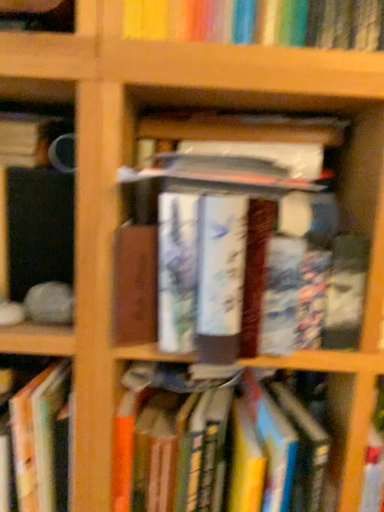
What do you see at coordinates (246, 68) in the screenshot? I see `wooden shelf at upper center` at bounding box center [246, 68].

The height and width of the screenshot is (512, 384). Find the location of `hardcover book at center, arranged as the 3th book when ordered from the bottom`. hardcover book at center, arranged as the 3th book when ordered from the bottom is located at coordinates (252, 264).

Describe the element at coordinates (252, 264) in the screenshot. The image size is (384, 512). I see `hardcover book at center, arranged as the 3th book when ordered from the bottom` at that location.

What do you see at coordinates (29, 138) in the screenshot? This screenshot has height=512, width=384. I see `matte black mug at left, arranged as the 1th book when viewed from the top` at bounding box center [29, 138].

You are a GUI agent. You are given a task and a screenshot of the screen. Output one action in this format:
    pyautogui.click(x=<x>, y=<y>)
    Task: Click on the matte black mug at left, which is the fourth book in bottom-to-top order
    The width and height of the screenshot is (384, 512).
    Given the screenshot: What is the action you would take?
    coord(29,138)

Where is `wooden shelf at upper center`? wooden shelf at upper center is located at coordinates (246, 68).

Considering the relative sizes of hardcover book at center, the 2th book from the top, and wooden shelf at upper center in the image provided, is hardcover book at center, the 2th book from the top, smaller than wooden shelf at upper center?

Actually, hardcover book at center, the 2th book from the top, might be larger than wooden shelf at upper center.

Is hardcover book at center, the 2th book from the top, inside the boundaries of wooden shelf at upper center, or outside?

hardcover book at center, the 2th book from the top, is outside wooden shelf at upper center.

Is hardcover book at center, the 2th book from the top, turned away from wooden shelf at upper center?

No, hardcover book at center, the 2th book from the top, is not facing away from wooden shelf at upper center.

Looking at their sizes, would you say hardcover book at center, arranged as the 3th book when ordered from the bottom, is wider or thinner than wooden shelf at upper center?

Considering their sizes, hardcover book at center, arranged as the 3th book when ordered from the bottom, looks slimmer than wooden shelf at upper center.

Does hardcover book at lower left, the third book when ordered from top to bottom, have a lesser width compared to hardcover book at center, the 2th book from the top?

Yes.

Considering the sizes of objects hardcover book at lower left, the third book when ordered from top to bottom, and hardcover book at center, arranged as the 3th book when ordered from the bottom, in the image provided, who is shorter, hardcover book at lower left, the third book when ordered from top to bottom, or hardcover book at center, arranged as the 3th book when ordered from the bottom,?

hardcover book at center, arranged as the 3th book when ordered from the bottom, is shorter.

Is hardcover book at lower left, the second book from the bottom, not close to hardcover book at center, arranged as the 3th book when ordered from the bottom?

No, hardcover book at lower left, the second book from the bottom, is not far away from hardcover book at center, arranged as the 3th book when ordered from the bottom.

Is hardcover book at lower left, the second book from the bottom, in front of or behind hardcover book at center, the 2th book from the top, in the image?

hardcover book at lower left, the second book from the bottom, is behind hardcover book at center, the 2th book from the top.

Measure the distance between wooden shelf at upper center and hardcover book at center, the 2th book from the top.

The distance of wooden shelf at upper center from hardcover book at center, the 2th book from the top, is 8.61 inches.

Is wooden shelf at upper center located outside hardcover book at center, the 2th book from the top?

Yes, wooden shelf at upper center is not within hardcover book at center, the 2th book from the top.

Is wooden shelf at upper center bigger than hardcover book at center, the 2th book from the top?

Actually, wooden shelf at upper center might be smaller than hardcover book at center, the 2th book from the top.

Considering the points (137, 56) and (290, 203), which point is behind, point (137, 56) or point (290, 203)?

Positioned behind is point (290, 203).

From the image's perspective, which one is positioned lower, hardcover book at center, arranged as the 3th book when ordered from the bottom, or matte black mug at left, arranged as the 1th book when viewed from the top?

hardcover book at center, arranged as the 3th book when ordered from the bottom, appears lower in the image.

How many degrees apart are the facing directions of hardcover book at center, the 2th book from the top, and matte black mug at left, which is the fourth book in bottom-to-top order?

There is a 0.000235-degree angle between the facing directions of hardcover book at center, the 2th book from the top, and matte black mug at left, which is the fourth book in bottom-to-top order.

Does hardcover book at center, arranged as the 3th book when ordered from the bottom, have a smaller size compared to matte black mug at left, which is the fourth book in bottom-to-top order?

No.

Can you see matte black mug at left, which is the fourth book in bottom-to-top order, touching hardcover book at center, arranged as the 3th book when ordered from the bottom?

No, matte black mug at left, which is the fourth book in bottom-to-top order, is not in contact with hardcover book at center, arranged as the 3th book when ordered from the bottom.

Considering the sizes of matte black mug at left, arranged as the 1th book when viewed from the top, and hardcover book at center, the 2th book from the top, in the image, is matte black mug at left, arranged as the 1th book when viewed from the top, bigger or smaller than hardcover book at center, the 2th book from the top,?

matte black mug at left, arranged as the 1th book when viewed from the top, is smaller than hardcover book at center, the 2th book from the top.

Can you confirm if matte black mug at left, which is the fourth book in bottom-to-top order, is positioned to the right of hardcover book at center, arranged as the 3th book when ordered from the bottom?

No, matte black mug at left, which is the fourth book in bottom-to-top order, is not to the right of hardcover book at center, arranged as the 3th book when ordered from the bottom.

Is wooden shelf at upper center at the left side of hardcover book at center, which is counted as the fourth book, starting from the top?

Incorrect, wooden shelf at upper center is not on the left side of hardcover book at center, which is counted as the fourth book, starting from the top.

Based on the photo, from the image's perspective, which object appears higher, wooden shelf at upper center or hardcover book at center, which is the first book in bottom-to-top order?

wooden shelf at upper center, from the image's perspective.

Which of these two, wooden shelf at upper center or hardcover book at center, which is counted as the fourth book, starting from the top, is smaller?

With smaller size is wooden shelf at upper center.

Is hardcover book at center, which is counted as the fourth book, starting from the top, at the back of hardcover book at lower left, the third book when ordered from top to bottom?

hardcover book at lower left, the third book when ordered from top to bottom, is not turned away from hardcover book at center, which is counted as the fourth book, starting from the top.

This screenshot has height=512, width=384. What are the coordinates of `the 1st book in front of the hardcover book at lower left, the third book when ordered from top to bottom` in the screenshot? It's located at (211, 441).

In the image, is hardcover book at lower left, the third book when ordered from top to bottom, positioned in front of or behind hardcover book at center, which is counted as the fourth book, starting from the top?

Visually, hardcover book at lower left, the third book when ordered from top to bottom, is located behind hardcover book at center, which is counted as the fourth book, starting from the top.

Where is `the 1st book counting from the left side of the wooden shelf at upper center`? The image size is (384, 512). the 1st book counting from the left side of the wooden shelf at upper center is located at coordinates (252, 264).

From the hardcover book at lower left, the second book from the bottom, count 2nd book to the right and point to it. Please provide its 2D coordinates.

[(252, 264)]

When comparing their distances from matte black mug at left, which is the fourth book in bottom-to-top order, does hardcover book at center, the 2th book from the top, or hardcover book at center, which is the first book in bottom-to-top order, seem closer?

hardcover book at center, the 2th book from the top, is closer to matte black mug at left, which is the fourth book in bottom-to-top order.

From the image, which object appears to be farther from matte black mug at left, arranged as the 1th book when viewed from the top, hardcover book at center, arranged as the 3th book when ordered from the bottom, or hardcover book at lower left, the second book from the bottom?

hardcover book at lower left, the second book from the bottom, lies further to matte black mug at left, arranged as the 1th book when viewed from the top, than the other object.

Estimate the real-world distances between objects in this image. Which object is closer to hardcover book at lower left, the third book when ordered from top to bottom, hardcover book at center, which is counted as the fourth book, starting from the top, or wooden shelf at upper center?

Among the two, hardcover book at center, which is counted as the fourth book, starting from the top, is located nearer to hardcover book at lower left, the third book when ordered from top to bottom.

Looking at the image, which one is located further to hardcover book at center, arranged as the 3th book when ordered from the bottom, matte black mug at left, arranged as the 1th book when viewed from the top, or wooden shelf at upper center?

The object further to hardcover book at center, arranged as the 3th book when ordered from the bottom, is matte black mug at left, arranged as the 1th book when viewed from the top.

Estimate the real-world distances between objects in this image. Which object is further from hardcover book at center, the 2th book from the top, matte black mug at left, arranged as the 1th book when viewed from the top, or hardcover book at lower left, the second book from the bottom?

Among the two, matte black mug at left, arranged as the 1th book when viewed from the top, is located further to hardcover book at center, the 2th book from the top.

Looking at the image, which one is located closer to hardcover book at center, which is counted as the fourth book, starting from the top, matte black mug at left, arranged as the 1th book when viewed from the top, or hardcover book at lower left, the third book when ordered from top to bottom?

hardcover book at lower left, the third book when ordered from top to bottom.

Looking at the image, which one is located further to wooden shelf at upper center, matte black mug at left, which is the fourth book in bottom-to-top order, or hardcover book at lower left, the third book when ordered from top to bottom?

hardcover book at lower left, the third book when ordered from top to bottom, lies further to wooden shelf at upper center than the other object.

Estimate the real-world distances between objects in this image. Which object is further from hardcover book at lower left, the third book when ordered from top to bottom, wooden shelf at upper center or hardcover book at center, which is counted as the fourth book, starting from the top?

The object further to hardcover book at lower left, the third book when ordered from top to bottom, is wooden shelf at upper center.

Identify the location of book between hardcover book at lower left, the third book when ordered from top to bottom, and hardcover book at center, the 2th book from the top. (211, 441).

Locate an element on the screen. This screenshot has height=512, width=384. book between matte black mug at left, arranged as the 1th book when viewed from the top, and hardcover book at lower left, the second book from the bottom, from top to bottom is located at coordinates (252, 264).